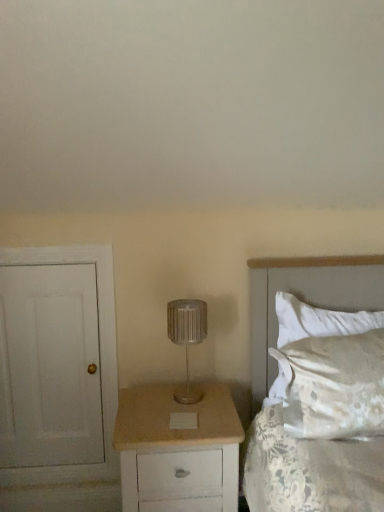
Where is `vacant location below silver metallic lamp at center (from a real-world perspective)`? vacant location below silver metallic lamp at center (from a real-world perspective) is located at coordinates (193, 393).